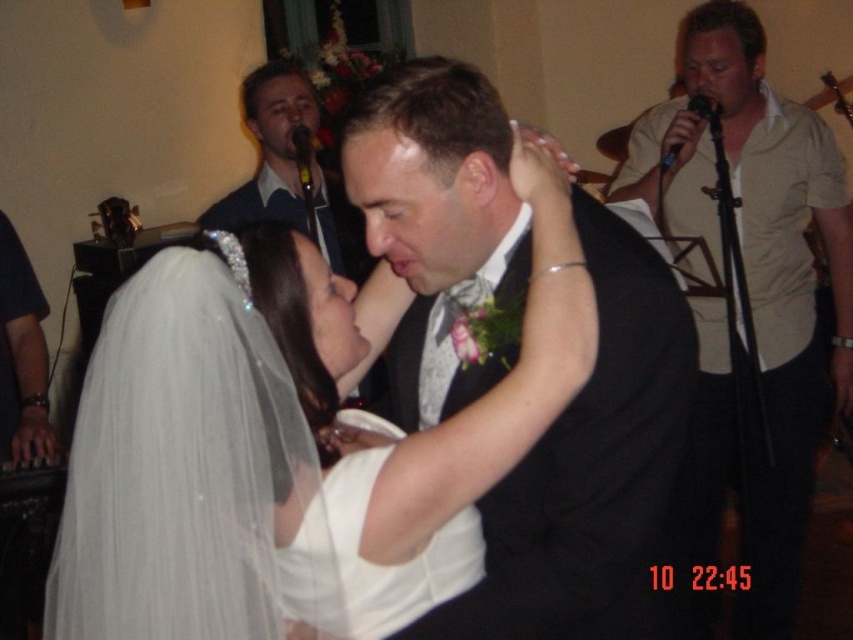
Between beige shirt at upper right and matte black suit at upper center, which one is positioned lower?

beige shirt at upper right is lower down.

Which is in front, point (788, 349) or point (283, 70)?

Point (788, 349) is more forward.

Locate an element on the screen. The width and height of the screenshot is (853, 640). beige shirt at upper right is located at coordinates (769, 307).

Which is above, white satin dress at center or matte black suit at upper center?

matte black suit at upper center is higher up.

Who is more distant from viewer, (x=364, y=456) or (x=288, y=128)?

The point (x=288, y=128) is behind.

Is point (451, 548) farther from camera compared to point (360, 264)?

No, (451, 548) is closer to viewer.

This screenshot has height=640, width=853. In order to click on white satin dress at center in this screenshot , I will do `click(369, 561)`.

Measure the distance from black satin suit at center to white satin dress at center.

A distance of 8.51 inches exists between black satin suit at center and white satin dress at center.

Between black satin suit at center and white satin dress at center, which one appears on the left side from the viewer's perspective?

white satin dress at center

Where is `black satin suit at center`? black satin suit at center is located at coordinates (596, 472).